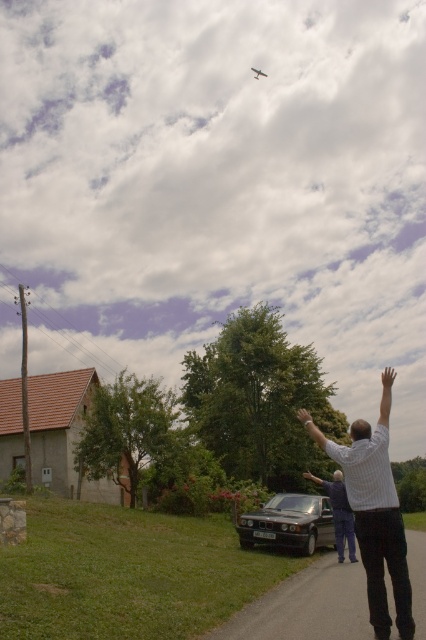
Question: Estimate the real-world distances between objects in this image. Which object is closer to the white striped shirt at center?

Choices:
 (A) smooth skin arm at center
 (B) black matte car at lower center

Answer: (A)

Question: Which point is closer to the camera taking this photo?

Choices:
 (A) (x=311, y=474)
 (B) (x=377, y=500)
 (C) (x=271, y=528)

Answer: (B)

Question: Can you confirm if white striped shirt at center is positioned to the right of black matte car at lower center?

Choices:
 (A) yes
 (B) no

Answer: (A)

Question: Does black matte car at lower center have a greater width compared to metallic silver airplane at upper center?

Choices:
 (A) no
 (B) yes

Answer: (A)

Question: Can you confirm if smooth skin arm at center is positioned to the right of metallic silver airplane at upper center?

Choices:
 (A) yes
 (B) no

Answer: (B)

Question: Which object is positioned closest to the smooth skin arm at center?

Choices:
 (A) metallic silver airplane at upper center
 (B) black matte car at lower center
 (C) white striped shirt at center

Answer: (B)